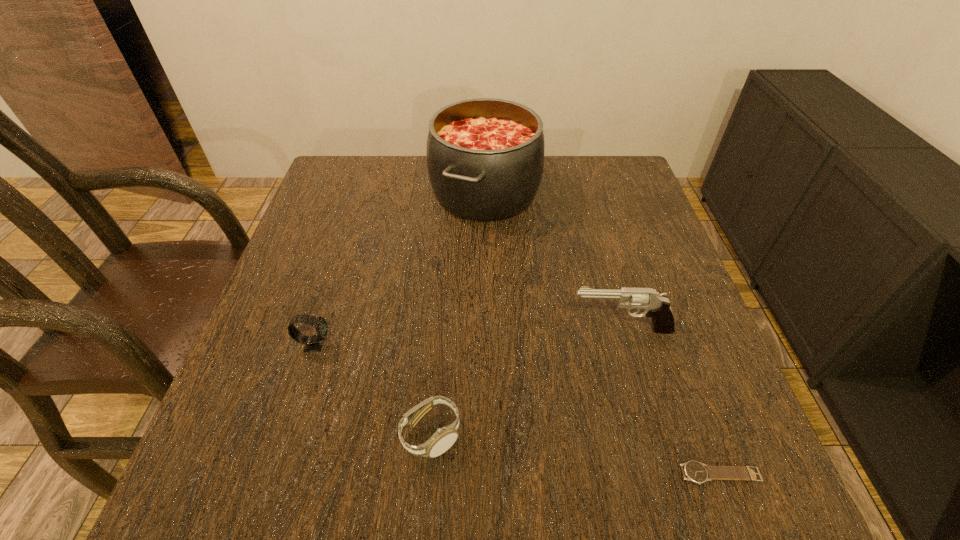
This screenshot has height=540, width=960. I want to click on the farthest object, so click(x=485, y=157).

Locate an element on the screen. This screenshot has height=540, width=960. casserole is located at coordinates click(x=485, y=157).

The height and width of the screenshot is (540, 960). What are the coordinates of `gun` in the screenshot? It's located at (655, 305).

Locate an element on the screen. This screenshot has height=540, width=960. the fourth shortest object is located at coordinates (655, 305).

Identify the location of the farthest watch. (313, 343).

Where is `the leftmost watch`? the leftmost watch is located at coordinates (313, 343).

You are a GUI agent. You are given a task and a screenshot of the screen. Output one action in this format:
    pyautogui.click(x=<x>, y=<y>)
    Task: Click on the second watch from left to right
    
    Given the screenshot: What is the action you would take?
    pyautogui.click(x=443, y=439)

I want to click on the fourth tallest object, so click(x=443, y=439).

Where is `the shortest object`? The width and height of the screenshot is (960, 540). the shortest object is located at coordinates (694, 471).

Where is `the shortest watch`? This screenshot has height=540, width=960. the shortest watch is located at coordinates (694, 471).